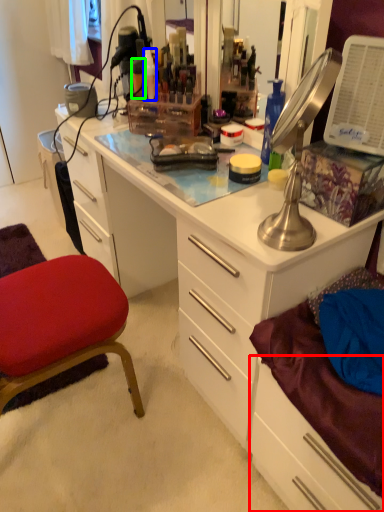
Question: Which object is the farthest from drawer (highlighted by a red box)? Choose among these: toiletry (highlighted by a blue box) or toiletry (highlighted by a green box).

Choices:
 (A) toiletry
 (B) toiletry

Answer: (B)